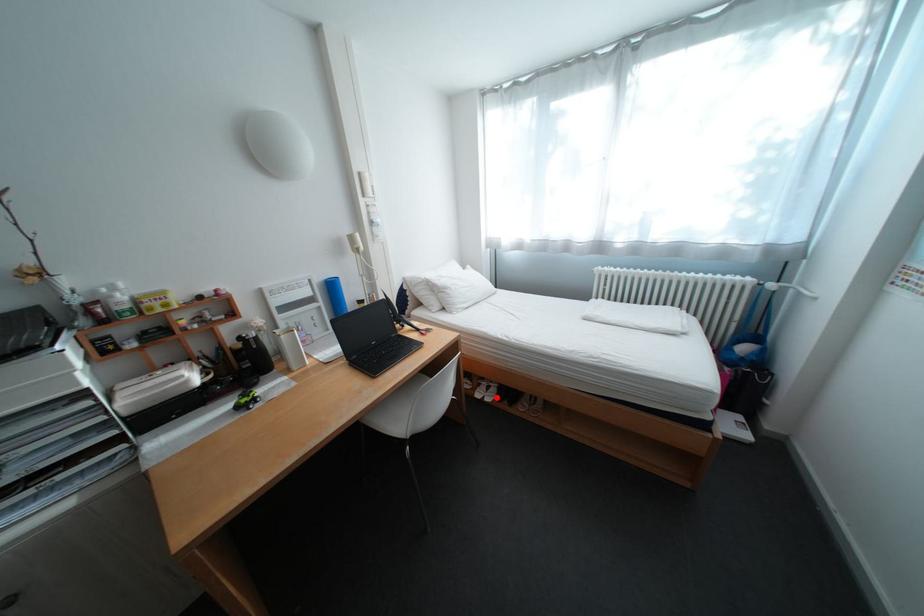
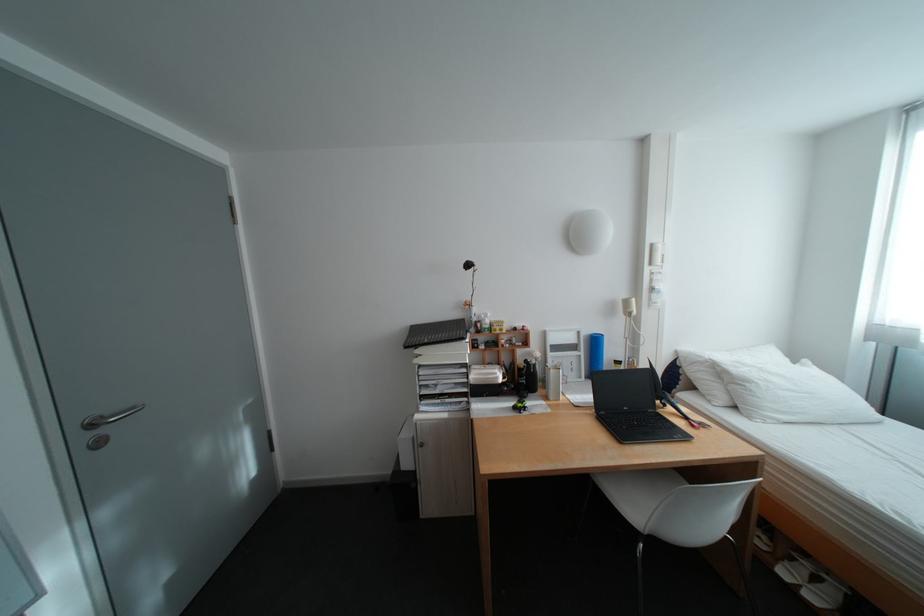
The point at the highlighted location is marked in the first image. Where is the corresponding point in the second image?

(813, 586)